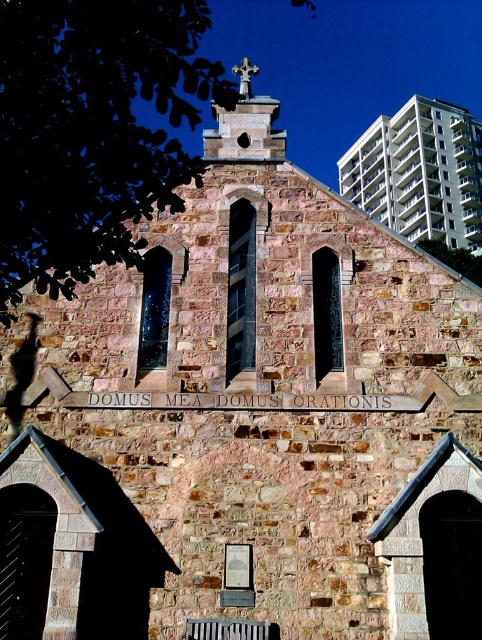
Consider the image. You are standing in front of the church and want to take a photo that includes both the white concrete building at upper right and the smooth stone spire at upper center. Which one of these objects should you position closer to the top of your camera frame to ensure both are fully visible?

The smooth stone spire at upper center is taller than the white concrete building at upper right, so you should position the smooth stone spire at upper center closer to the top of the camera frame to ensure both are fully visible.

Looking at this image, you are standing in front of the church and want to take a photo that includes both the white concrete building at upper right and the wooden slats at lower center. Which object should you position to the left side of your camera frame to ensure both are visible?

You should position the wooden slats at lower center to the left side of your camera frame because the white concrete building at upper right is located to the right of the wooden slats at lower center, so placing the wooden slats on the left will allow both objects to be captured in the frame.

You are standing in front of the church and want to take a photo of the smooth stone spire at upper center and the wooden slats at lower center. Which object will appear larger in the photo?

The smooth stone spire at upper center will appear larger in the photo because it is closer to the camera than the wooden slats at lower center.